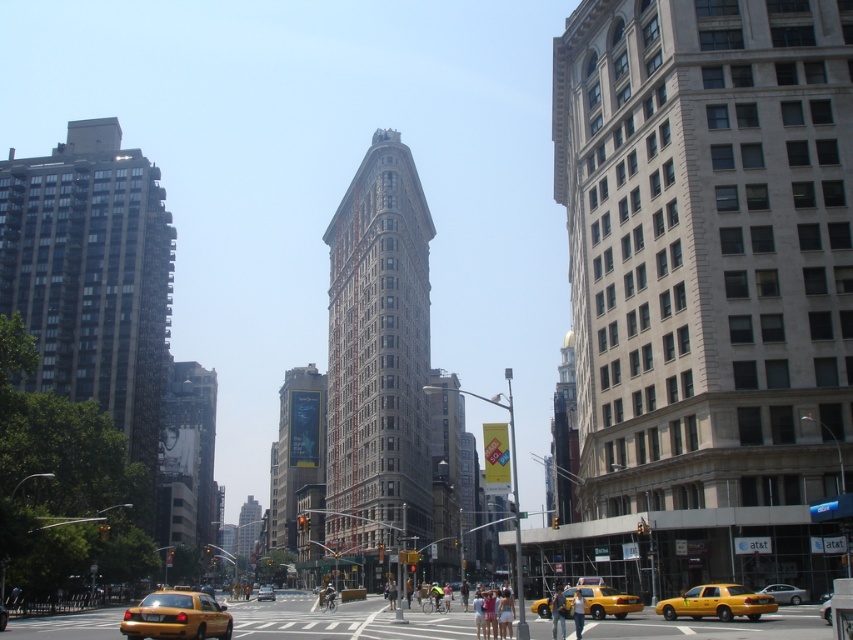
Is point (171, 636) closer to viewer compared to point (601, 586)?

Yes, point (171, 636) is closer to viewer.

Can you confirm if yellow rubber taxi at lower left is positioned above yellow matte taxi at center?

Incorrect, yellow rubber taxi at lower left is not positioned above yellow matte taxi at center.

Is point (132, 636) closer to camera compared to point (584, 609)?

Yes, point (132, 636) is in front of point (584, 609).

The width and height of the screenshot is (853, 640). In order to click on yellow rubber taxi at lower left in this screenshot , I will do `click(177, 616)`.

Between yellow matte taxi at lower right and yellow matte taxi at center, which one has more height?

With more height is yellow matte taxi at center.

Which is more to the left, yellow matte taxi at lower right or yellow matte taxi at center?

From the viewer's perspective, yellow matte taxi at center appears more on the left side.

I want to click on yellow matte taxi at lower right, so [x=717, y=602].

Describe the element at coordinates (177, 616) in the screenshot. I see `yellow rubber taxi at lower left` at that location.

Is yellow rubber taxi at lower left thinner than yellow matte taxi at lower right?

No.

Locate an element on the screen. yellow rubber taxi at lower left is located at coordinates (177, 616).